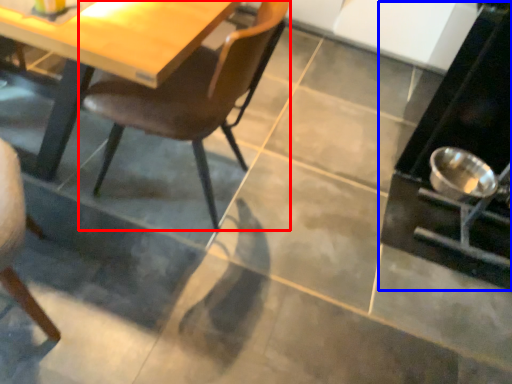
Question: Which point is further to the camera, chair (highlighted by a red box) or appliance (highlighted by a blue box)?

Choices:
 (A) chair
 (B) appliance

Answer: (B)